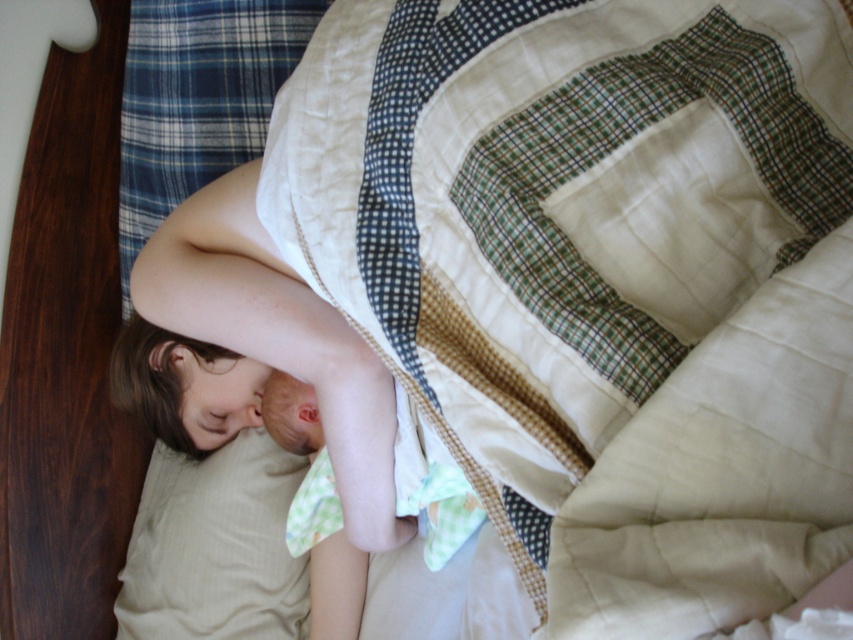
Is point (120, 376) less distant than point (199, 499)?

Yes, point (120, 376) is in front of point (199, 499).

Does smooth skin girl at center have a smaller size compared to beige fabric pillow at lower left?

No, smooth skin girl at center is not smaller than beige fabric pillow at lower left.

Is point (259, 262) positioned behind point (207, 628)?

That is False.

Find the location of a particular element. The height and width of the screenshot is (640, 853). smooth skin girl at center is located at coordinates (254, 356).

Does quilted beige blanket at center appear on the left side of beige fabric pillow at lower left?

Incorrect, quilted beige blanket at center is not on the left side of beige fabric pillow at lower left.

Is point (331, 205) behind point (263, 621)?

That is False.

Where is `quilted beige blanket at center`? quilted beige blanket at center is located at coordinates (602, 278).

Looking at this image, between quilted beige blanket at center and smooth skin girl at center, which one appears on the right side from the viewer's perspective?

From the viewer's perspective, quilted beige blanket at center appears more on the right side.

Does point (397, 202) come in front of point (202, 211)?

That is True.

Where is `quilted beige blanket at center`? Image resolution: width=853 pixels, height=640 pixels. quilted beige blanket at center is located at coordinates (602, 278).